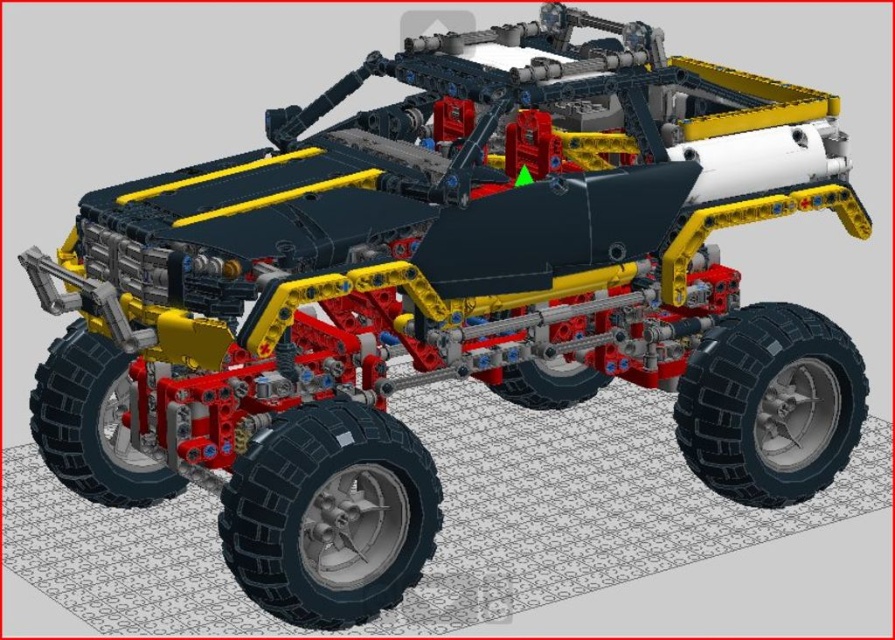
You are an engineer inspecting the LEGO vehicle. You notice two black rubber tires. Which one has a larger width? The options are the black rubber tire at lower right and the black rubber tire at center.

The black rubber tire at lower right might be wider than black rubber tire at center according to the description.

You are examining the LEGO vehicle from the front. Which tire, the black rubber tire at lower center or the black rubber tire at lower left, is positioned closer to you?

The black rubber tire at lower center is positioned closer to the viewer than the black rubber tire at lower left.

What object is located at the coordinates point (329,515) in the image?

The point (329,515) indicates the black rubber tire at lower center.